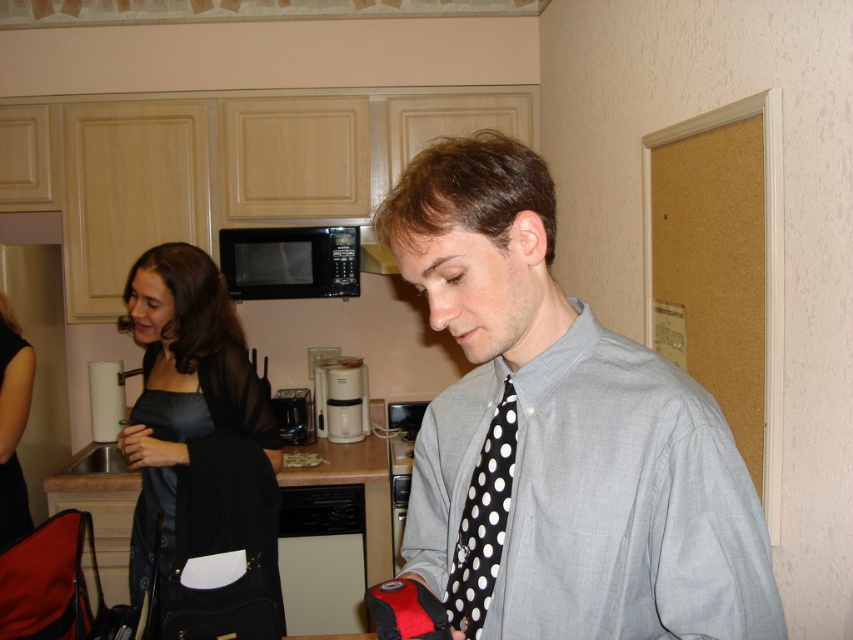
Which of these two, gray cotton shirt at center or black satin dress at center, stands shorter?

gray cotton shirt at center

Can you confirm if gray cotton shirt at center is positioned to the left of black satin dress at center?

In fact, gray cotton shirt at center is to the right of black satin dress at center.

In the scene shown: Measure the distance between gray cotton shirt at center and camera.

74.66 centimeters

This screenshot has width=853, height=640. I want to click on gray cotton shirt at center, so click(x=555, y=442).

Is point (142, 580) behind point (352, 381)?

No, it is not.

Describe the element at coordinates (196, 422) in the screenshot. I see `black satin dress at center` at that location.

At what (x,y) coordinates should I click in order to perform the action: click on black satin dress at center. Please return your answer as a coordinate pair (x, y). The width and height of the screenshot is (853, 640). Looking at the image, I should click on (196, 422).

Is gray cotton shirt at center smaller than black matte microwave at upper center?

Actually, gray cotton shirt at center might be larger than black matte microwave at upper center.

Is gray cotton shirt at center to the left of black matte microwave at upper center from the viewer's perspective?

No, gray cotton shirt at center is not to the left of black matte microwave at upper center.

Which is behind, point (633, 522) or point (248, 236)?

The point (248, 236) is more distant.

Locate an element on the screen. gray cotton shirt at center is located at coordinates (555, 442).